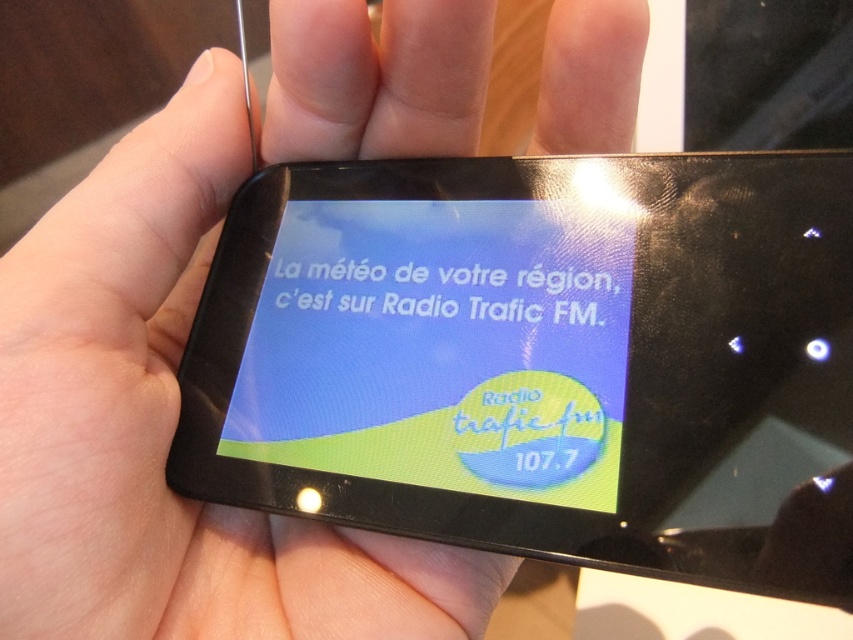
Question: Does matte black screen at center appear on the right side of white glossy text at center?

Choices:
 (A) yes
 (B) no

Answer: (B)

Question: Which is farther from the white glossy text at center?

Choices:
 (A) glossy black screen at center
 (B) matte black screen at center

Answer: (A)

Question: In this image, where is matte black screen at center located relative to white glossy text at center?

Choices:
 (A) right
 (B) left

Answer: (B)

Question: Which point is closer to the camera?

Choices:
 (A) (312, 300)
 (B) (527, 268)
 (C) (396, 161)

Answer: (B)

Question: Can you confirm if matte black screen at center is thinner than white glossy text at center?

Choices:
 (A) yes
 (B) no

Answer: (B)

Question: Which object is positioned farthest from the matte black screen at center?

Choices:
 (A) white glossy text at center
 (B) glossy black screen at center

Answer: (A)